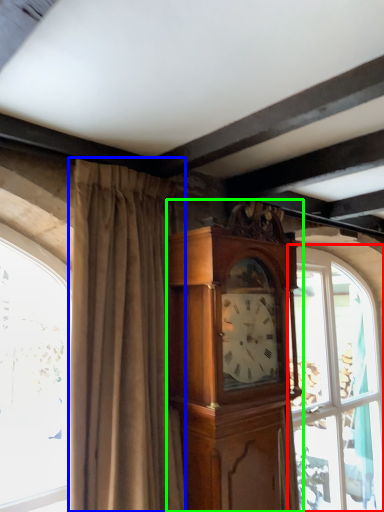
Question: Estimate the real-world distances between objects in this image. Which object is farther from window (highlighted by a red box), curtain (highlighted by a blue box) or cabinetry (highlighted by a green box)?

Choices:
 (A) curtain
 (B) cabinetry

Answer: (A)